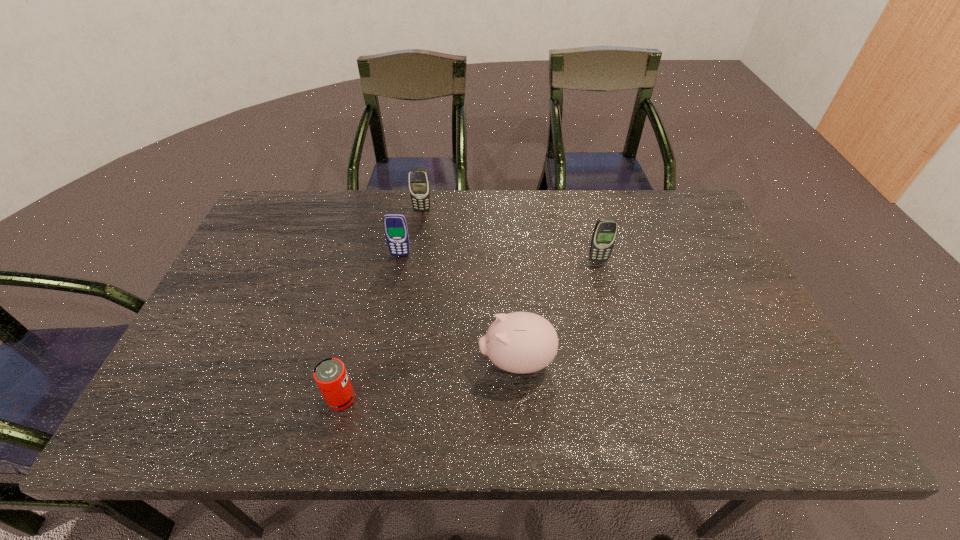
Where is `vacant region located 0.340m at the snout of the piggy bank`? vacant region located 0.340m at the snout of the piggy bank is located at coordinates (333, 361).

This screenshot has width=960, height=540. I want to click on free space located at the snout of the piggy bank, so click(x=350, y=361).

What are the coordinates of `vacant space situated 0.270m at the snout of the piggy bank` in the screenshot? It's located at (363, 361).

You are a GUI agent. You are given a task and a screenshot of the screen. Output one action in this format:
    pyautogui.click(x=<x>, y=<y>)
    Task: Click on the vacant area located 0.100m on the left of the shortest object
    The image size is (960, 540).
    Given the screenshot: What is the action you would take?
    pyautogui.click(x=281, y=399)

Identify the location of object at the far edge. This screenshot has height=540, width=960. (419, 184).

The height and width of the screenshot is (540, 960). I want to click on object located in the near edge section of the desktop, so click(x=330, y=374).

Identify the location of blank space at the far edge of the desktop. The height and width of the screenshot is (540, 960). (636, 202).

Identify the location of free region at the near edge. The image size is (960, 540). (284, 415).

In the image, there is a desktop. At what (x,y) coordinates should I click in order to perform the action: click on vacant space at the left edge. Please return your answer as a coordinate pair (x, y). The height and width of the screenshot is (540, 960). Looking at the image, I should click on (299, 239).

In the image, there is a desktop. What are the coordinates of `free region at the right edge` in the screenshot? It's located at (713, 348).